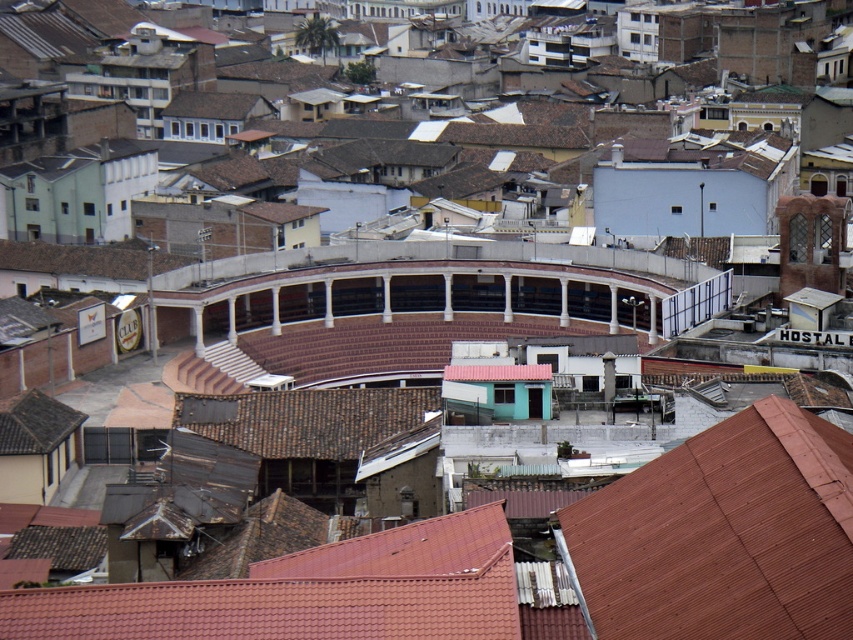
Question: Which point is closer to the camera taking this photo?

Choices:
 (A) (775, 499)
 (B) (659, 490)

Answer: (A)

Question: Does brown tile roof at center have a larger size compared to brown tile roof at lower right?

Choices:
 (A) no
 (B) yes

Answer: (B)

Question: Is the position of brown tile roof at center more distant than that of brown tile roof at lower right?

Choices:
 (A) yes
 (B) no

Answer: (A)

Question: Does brown tile roof at center have a smaller size compared to brown tile roof at lower right?

Choices:
 (A) no
 (B) yes

Answer: (A)